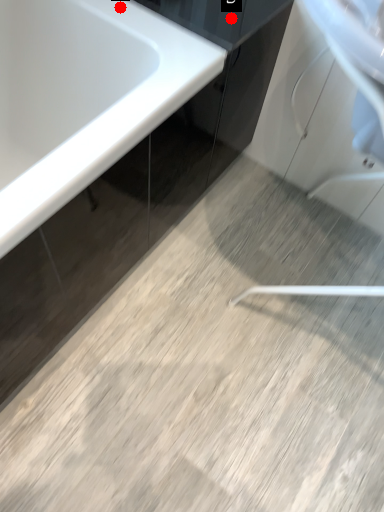
Question: Two points are circled on the image, labeled by A and B beside each circle. Which point is closer to the camera taking this photo?

Choices:
 (A) A is closer
 (B) B is closer

Answer: (B)